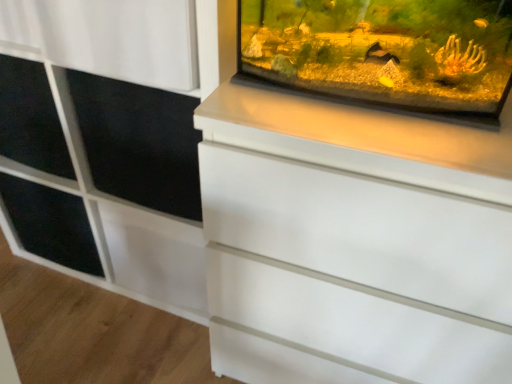
Question: Does black matte shelf at left lie behind black matte screen door at upper left?

Choices:
 (A) no
 (B) yes

Answer: (B)

Question: Is black matte shelf at left wider than black matte screen door at upper left?

Choices:
 (A) yes
 (B) no

Answer: (B)

Question: Is black matte shelf at left bigger than black matte screen door at upper left?

Choices:
 (A) yes
 (B) no

Answer: (B)

Question: Is black matte screen door at upper left inside black matte shelf at left?

Choices:
 (A) no
 (B) yes

Answer: (A)

Question: From a real-world perspective, is black matte shelf at left positioned over black matte screen door at upper left based on gravity?

Choices:
 (A) no
 (B) yes

Answer: (A)

Question: Is black matte shelf at left wider or thinner than black matte screen door at upper left?

Choices:
 (A) thin
 (B) wide

Answer: (A)

Question: In the image, is black matte shelf at left positioned in front of or behind black matte screen door at upper left?

Choices:
 (A) front
 (B) behind

Answer: (B)

Question: Would you say black matte shelf at left is to the left or to the right of black matte screen door at upper left in the picture?

Choices:
 (A) right
 (B) left

Answer: (B)

Question: Is black matte shelf at left spatially inside black matte screen door at upper left, or outside of it?

Choices:
 (A) inside
 (B) outside

Answer: (B)

Question: Is black matte screen door at upper left wider or thinner than white matte cabinet at upper right?

Choices:
 (A) wide
 (B) thin

Answer: (B)

Question: Considering the positions of black matte screen door at upper left and white matte cabinet at upper right in the image, is black matte screen door at upper left taller or shorter than white matte cabinet at upper right?

Choices:
 (A) tall
 (B) short

Answer: (B)

Question: From a real-world perspective, is black matte screen door at upper left above or below white matte cabinet at upper right?

Choices:
 (A) above
 (B) below

Answer: (A)

Question: Choose the correct answer: Is black matte screen door at upper left inside white matte cabinet at upper right or outside it?

Choices:
 (A) outside
 (B) inside

Answer: (B)

Question: From the image's perspective, is black matte screen door at upper left positioned above or below transparent glass tank at upper right?

Choices:
 (A) above
 (B) below

Answer: (B)

Question: From a real-world perspective, is black matte screen door at upper left positioned above or below transparent glass tank at upper right?

Choices:
 (A) above
 (B) below

Answer: (B)